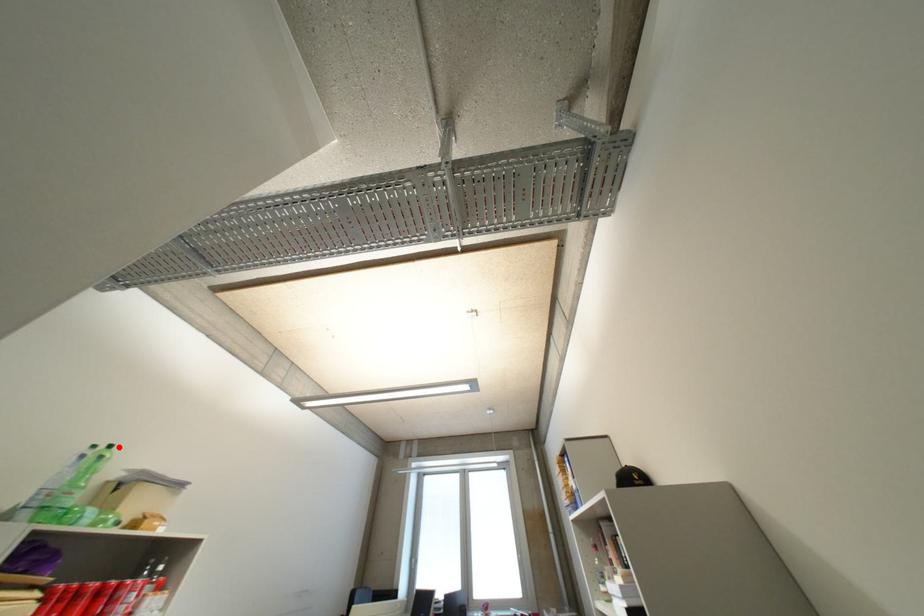
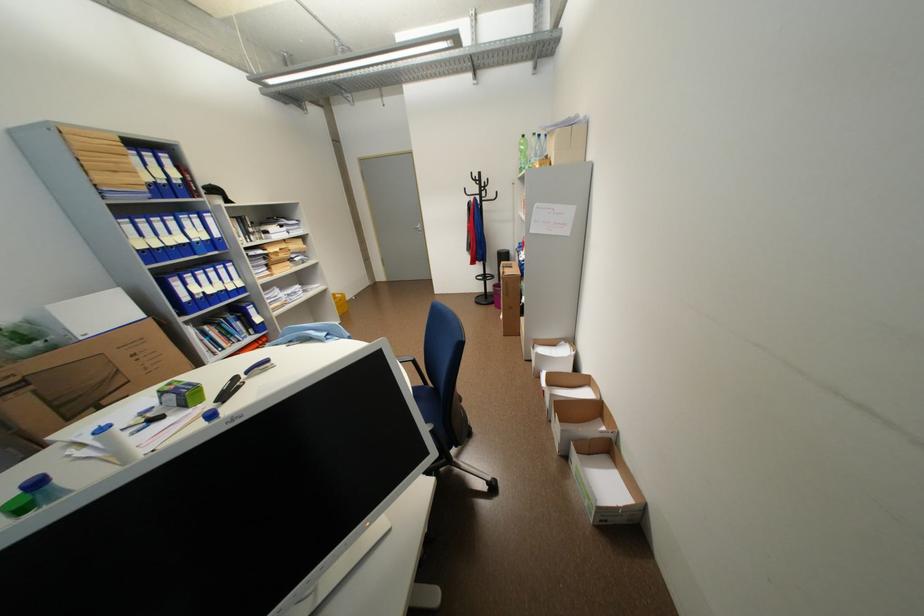
Find the pixel in the second image that matches the highlighted location in the first image.

(531, 137)